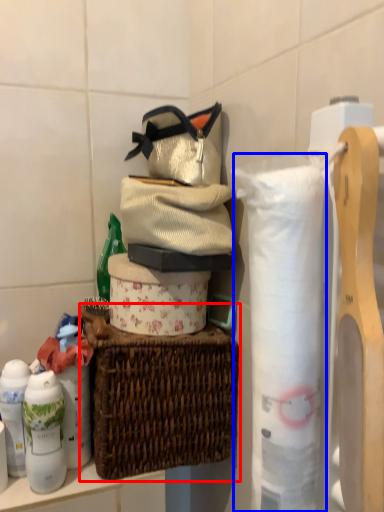
Question: Which object appears closest to the camera in this image, picnic basket (highlighted by a red box) or toilet paper (highlighted by a blue box)?

Choices:
 (A) picnic basket
 (B) toilet paper

Answer: (B)